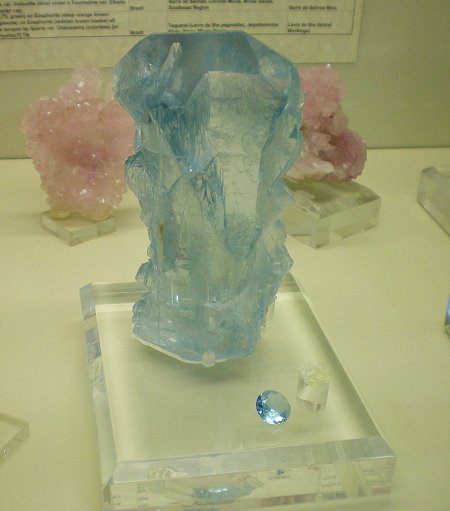
Find the location of `wall`. wall is located at coordinates (413, 57).